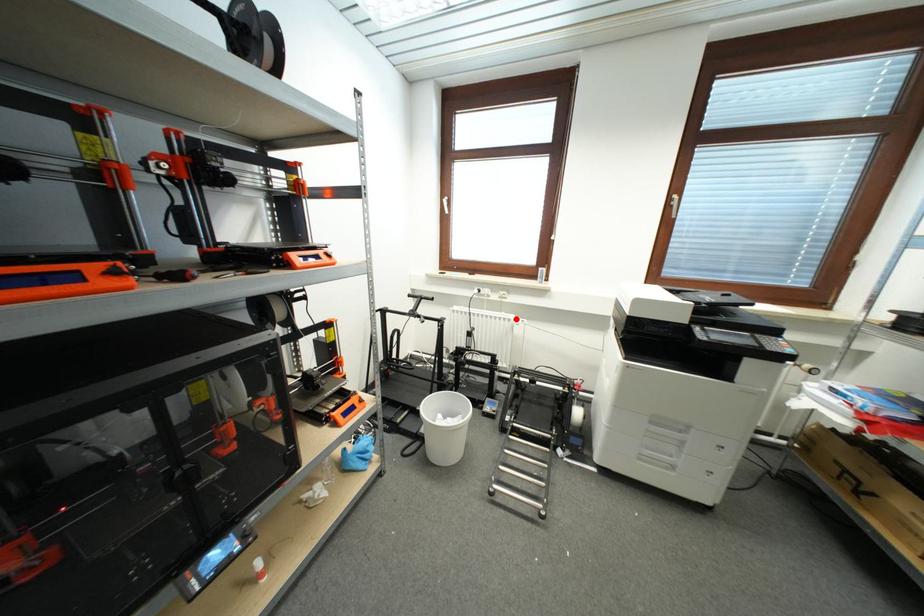
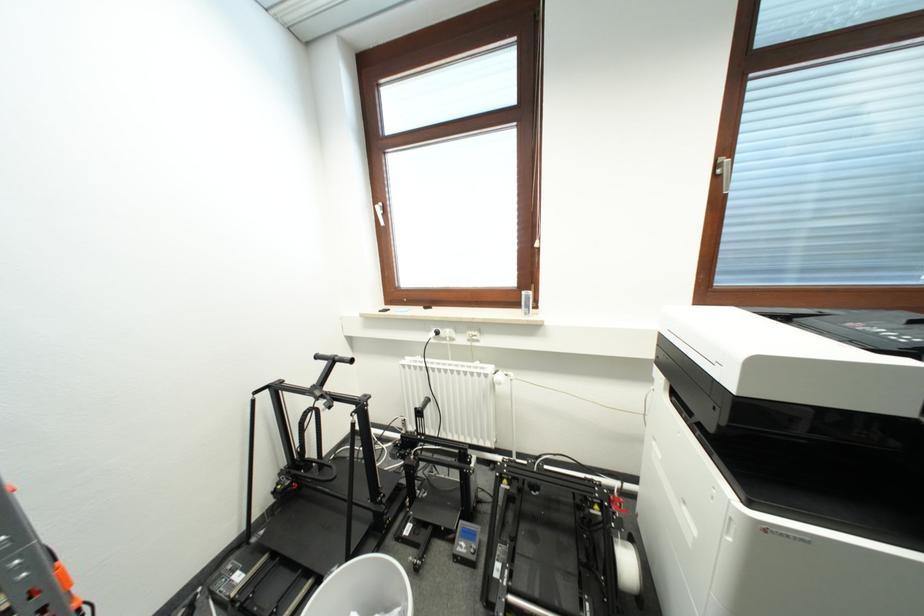
The point at the highlighted location is marked in the first image. Where is the corresponding point in the second image?

(494, 371)